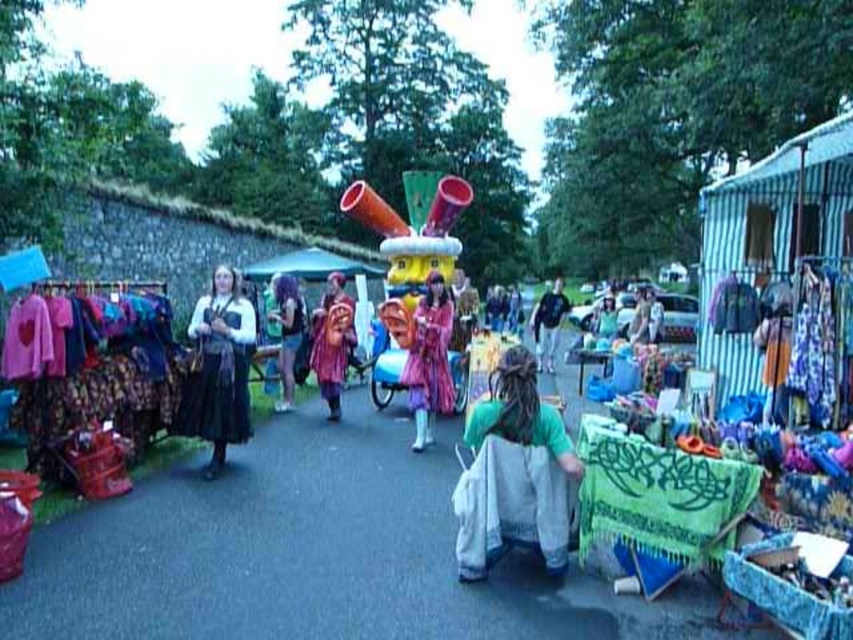
Who is positioned more to the right, shiny metallic helmet at center or black fabric dress at center?

black fabric dress at center

Between shiny metallic helmet at center and black fabric dress at center, which one appears on the left side from the viewer's perspective?

shiny metallic helmet at center

Image resolution: width=853 pixels, height=640 pixels. I want to click on shiny metallic helmet at center, so click(332, 349).

Between matte black dress at left and matte green fabric dress at center, which one appears on the right side from the viewer's perspective?

matte green fabric dress at center

Looking at this image, does matte black dress at left have a larger size compared to matte green fabric dress at center?

Yes.

Which is in front, point (230, 291) or point (653, 342)?

Positioned in front is point (230, 291).

This screenshot has width=853, height=640. I want to click on matte black dress at left, so click(219, 371).

Is green cotton shirt at center thinner than matte black dress at center?

No, green cotton shirt at center is not thinner than matte black dress at center.

How far apart are green cotton shirt at center and matte black dress at center?

5.89 meters

Is point (515, 508) behind point (283, 326)?

No, it is in front of (283, 326).

Locate an element on the screen. The height and width of the screenshot is (640, 853). green cotton shirt at center is located at coordinates (514, 490).